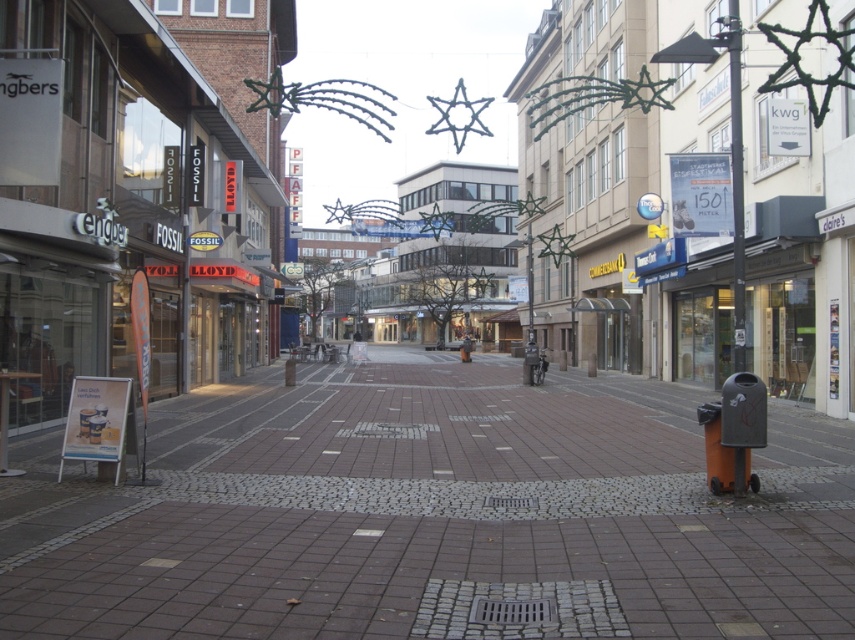
Which is below, brick paved street at center or matte black trash can at lower right?

brick paved street at center is lower down.

Does brick paved street at center appear under matte black trash can at lower right?

Yes, brick paved street at center is below matte black trash can at lower right.

Which is in front, point (437, 380) or point (150, 436)?

Point (150, 436) is more forward.

The height and width of the screenshot is (640, 855). Find the location of `brick paved street at center`. brick paved street at center is located at coordinates (432, 513).